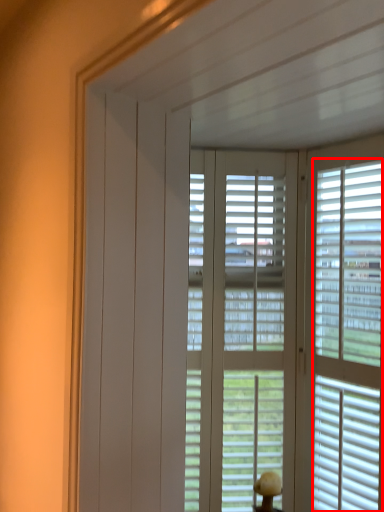
Question: In this image, where is blind (annotated by the red box) located relative to window blind?

Choices:
 (A) right
 (B) left

Answer: (A)